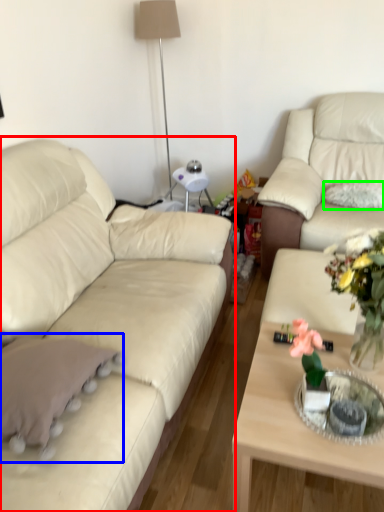
Question: Which is nearer to the studio couch (highlighted by a red box)? throw pillow (highlighted by a blue box) or pillow (highlighted by a green box).

Choices:
 (A) throw pillow
 (B) pillow

Answer: (A)